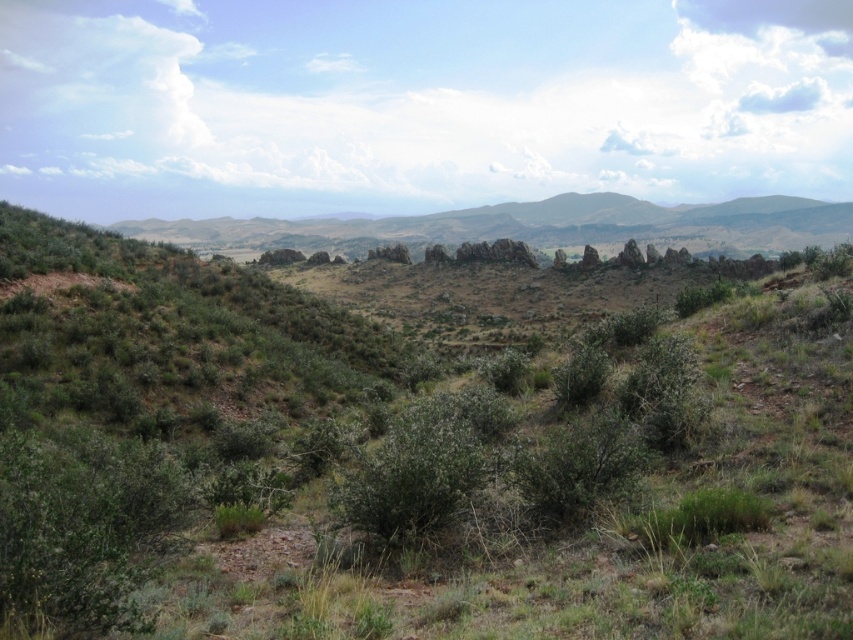
You are navigating a drone over the arid landscape shown. Your mission is to locate the green shrubbery at center. Using the coordinates provided, can you confirm if the point at [410,449] is the correct location for the shrubbery?

Yes, the point at [410,449] does indicate the green shrubbery at center according to the coordinates provided.

You are a hiker planning to take a photo of the green grassy mountain at center. You notice the green shrubbery at center is blocking your view. Can you adjust your position to avoid the shrubbery while still capturing the mountain?

The green shrubbery at center is in front of the green grassy mountain at center, so moving your position to either side of the shrubbery would allow you to capture the mountain without obstruction.